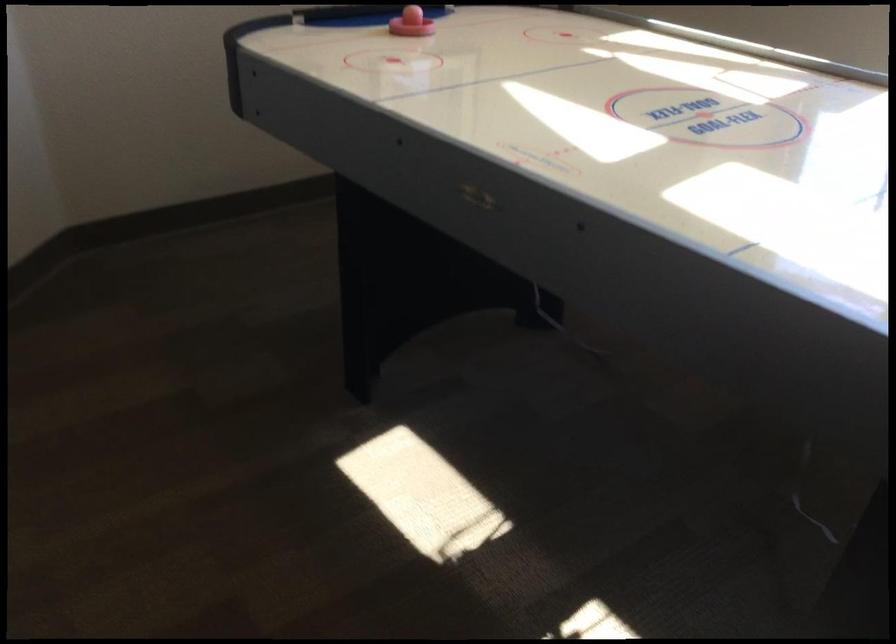
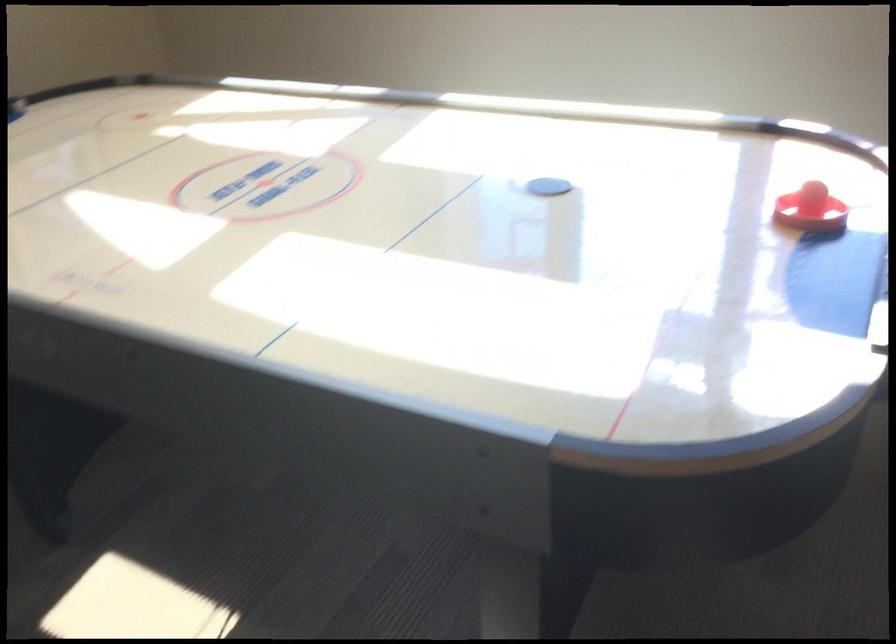
Question: The camera is either moving clockwise (left) or counter-clockwise (right) around the object. The first image is from the beginning of the video and the second image is from the end. Is the camera moving left or right when shooting the video?

Choices:
 (A) Left
 (B) Right

Answer: (A)